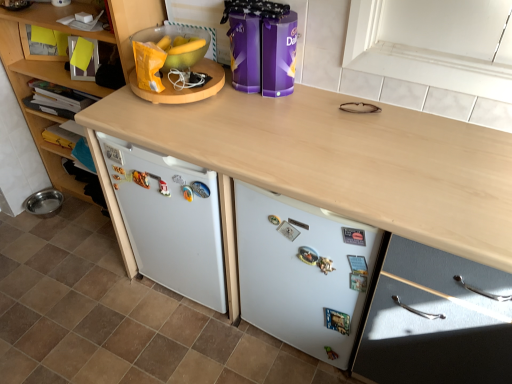
You are a GUI agent. You are given a task and a screenshot of the screen. Output one action in this format:
    pyautogui.click(x=<x>, y=<y>)
    Task: Click on the vacant space that is to the left of white matte refrigerator at lower center
    The image size is (512, 384).
    Given the screenshot: What is the action you would take?
    pyautogui.click(x=258, y=350)